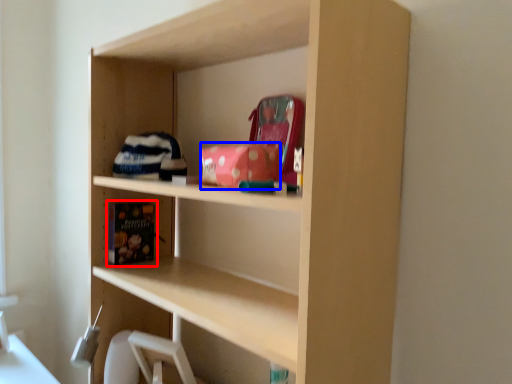
Question: Which point is further to the camera, book (highlighted by a red box) or book (highlighted by a blue box)?

Choices:
 (A) book
 (B) book

Answer: (A)